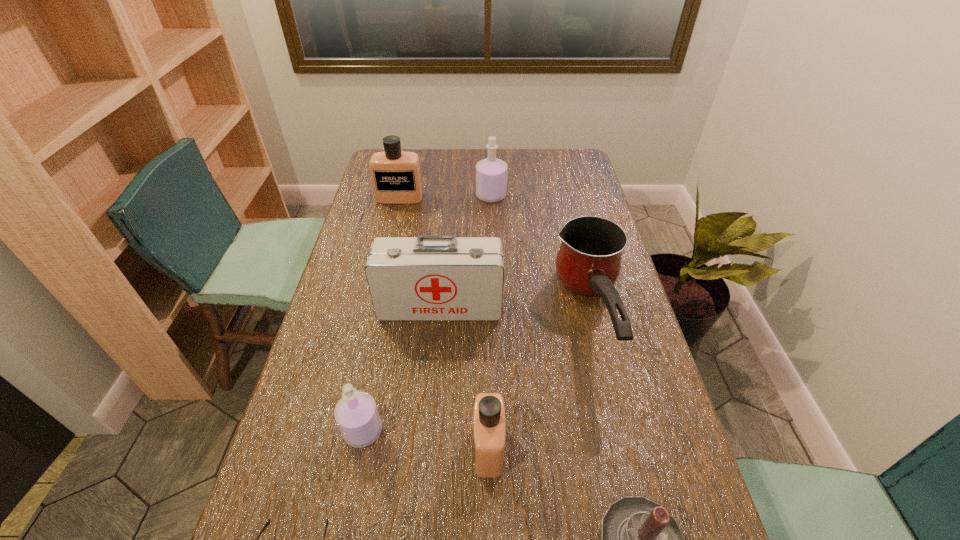
Locate an element on the screen. Image resolution: width=960 pixels, height=540 pixels. free space located 0.240m on the right of the right purple perfume is located at coordinates (568, 195).

Locate an element on the screen. The image size is (960, 540). vacant space situated on the front label of the farther beige perfume is located at coordinates (396, 212).

This screenshot has height=540, width=960. Identify the location of free space located on the front-facing side of the red first-aid kit. (427, 453).

I want to click on free space located 0.210m on the handle side of the saucepan, so (x=629, y=471).

The height and width of the screenshot is (540, 960). Find the location of `vacant area situated on the back of the left purple perfume`. vacant area situated on the back of the left purple perfume is located at coordinates (390, 299).

Where is `vacant region located on the front label of the right beige perfume`? This screenshot has width=960, height=540. vacant region located on the front label of the right beige perfume is located at coordinates (443, 448).

This screenshot has height=540, width=960. What are the coordinates of `free spot located on the front label of the right beige perfume` in the screenshot? It's located at (411, 448).

You are a GUI agent. You are given a task and a screenshot of the screen. Output one action in this format:
    pyautogui.click(x=<x>, y=<y>)
    Task: Click on the vacant space situated on the front label of the right beige perfume
    The width and height of the screenshot is (960, 540).
    Given the screenshot: What is the action you would take?
    pyautogui.click(x=302, y=448)

At what (x,y) coordinates should I click in order to perform the action: click on the first-aid kit that is at the left edge. Please return your answer as a coordinate pair (x, y). Looking at the image, I should click on (427, 278).

The height and width of the screenshot is (540, 960). In order to click on object located in the right edge section of the desktop in this screenshot , I will do `click(588, 262)`.